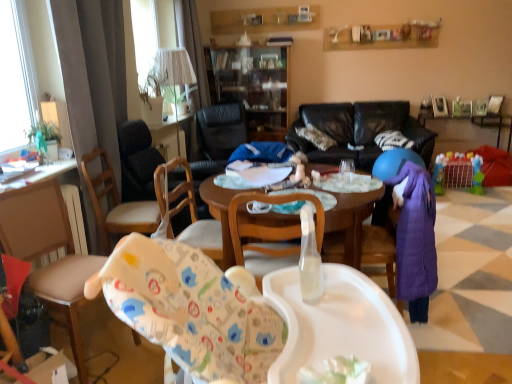
Question: In terms of width, does plastic toy basket at lower right, which is the second table from bottom to top, look wider or thinner when compared to white fabric lampshade at upper center?

Choices:
 (A) wide
 (B) thin

Answer: (B)

Question: Considering the positions of point (473, 119) and point (168, 57), is point (473, 119) closer or farther from the camera than point (168, 57)?

Choices:
 (A) closer
 (B) farther

Answer: (B)

Question: Which object is positioned farthest from the white fabric lampshade at upper center?

Choices:
 (A) wooden chair at left, which is counted as the fourth chair, starting from the back
 (B) green leafy plant at left
 (C) wooden chair at left
 (D) plastic toy basket at lower right, acting as the 1th table starting from the back
 (E) white soft pillow at center

Answer: (D)

Question: Which of these objects is positioned farthest from the green leafy plant at left?

Choices:
 (A) black leather chair at center, placed as the 4th chair when sorted from front to back
 (B) wooden chair at left
 (C) wooden chair at center, acting as the 3th chair starting from the back
 (D) white fabric lampshade at upper center
 (E) wooden chair at left, marked as the 1th chair in a front-to-back arrangement

Answer: (A)